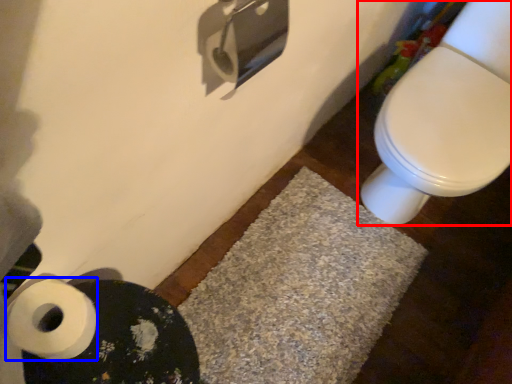
Question: Which object appears closest to the camera in this image, toilet (highlighted by a red box) or toilet paper (highlighted by a blue box)?

Choices:
 (A) toilet
 (B) toilet paper

Answer: (B)